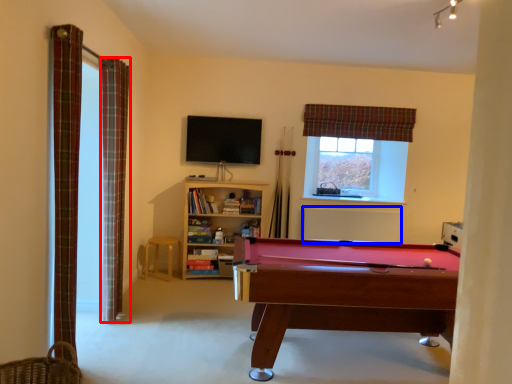
Question: Which point is closer to the camera, curtain (highlighted by a red box) or radiator (highlighted by a blue box)?

Choices:
 (A) curtain
 (B) radiator

Answer: (A)